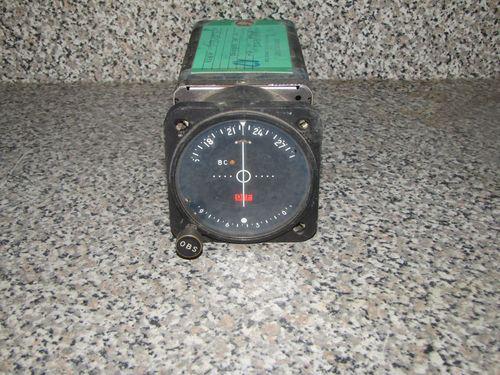
In order to click on counter top in this screenshot , I will do `click(98, 172)`.